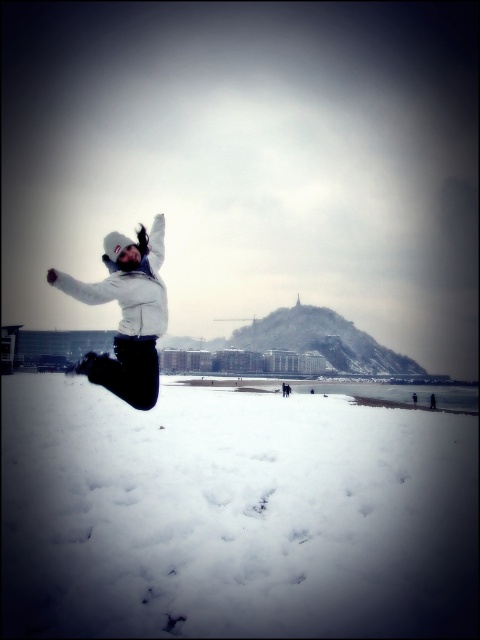
You are standing at the point marked as point (233,515) in the image. What is located exactly at that point?

The point (233,515) is where the white fluffy snow at lower center is located.

You are planning to build a snowman using the white fluffy snow at lower center and the white matte jacket at center. Since the snowman requires a base that is wider than the jacket, can you use the snow from the lower center area?

The white fluffy snow at lower center has a larger width than the white matte jacket at center, so yes, the snow from the lower center area can be used to create a base wider than the jacket.